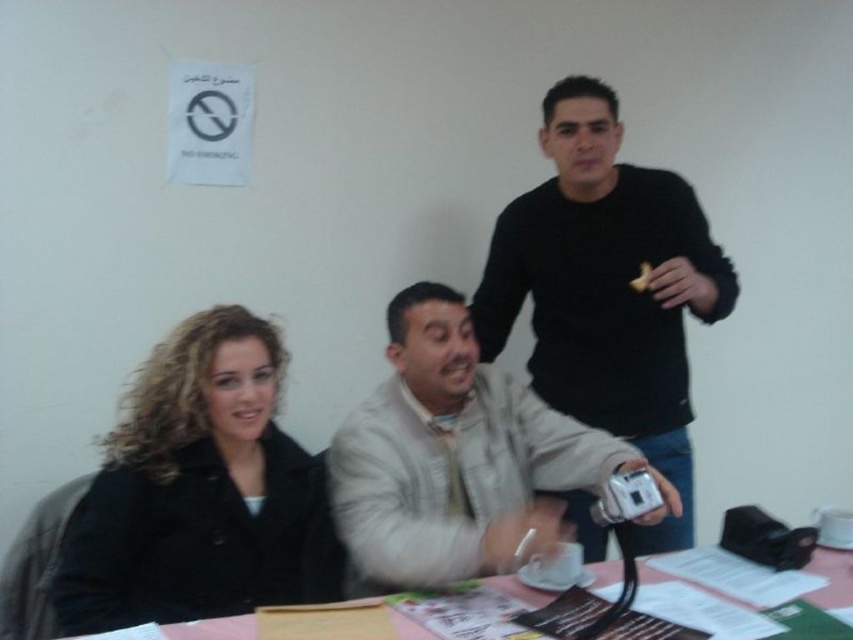
Question: Can you confirm if black matte sweater at upper right is thinner than beige textured jacket at center?

Choices:
 (A) yes
 (B) no

Answer: (A)

Question: Which of these objects is positioned closest to the beige textured jacket at center?

Choices:
 (A) black matte sweater at upper right
 (B) pink plastic table at lower center

Answer: (B)

Question: Based on their relative distances, which object is nearer to the pink plastic table at lower center?

Choices:
 (A) black matte sweater at upper right
 (B) beige textured jacket at center

Answer: (B)

Question: Among these points, which one is nearest to the camera?

Choices:
 (A) tap(398, 616)
 (B) tap(509, 554)

Answer: (A)

Question: Observing the image, what is the correct spatial positioning of black matte sweater at upper right in reference to beige textured jacket at center?

Choices:
 (A) right
 (B) left

Answer: (A)

Question: Is black matte sweater at upper right to the left of beige textured jacket at center from the viewer's perspective?

Choices:
 (A) yes
 (B) no

Answer: (B)